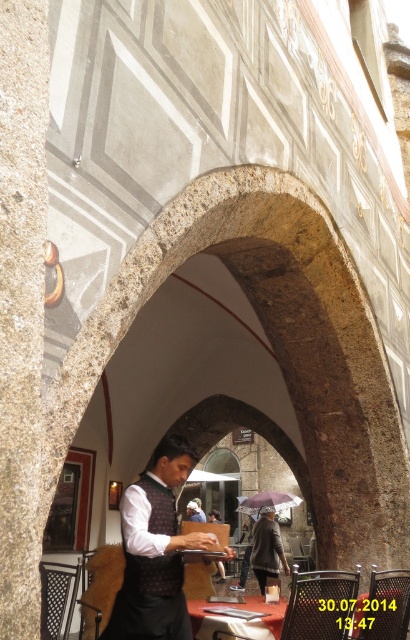
You are standing at the center of the archway and want to sit down. The wooden chair at lower left is your only option. Can you reach it without moving past the archway?

The wooden chair at lower left is located at point (100, 588), which is within the archway area, so you can reach it without moving past the archway.